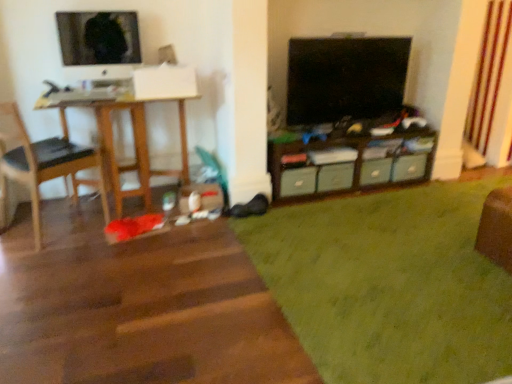
Locate an element on the screen. This screenshot has height=384, width=512. vacant area that is in front of black leather chair at left is located at coordinates (45, 263).